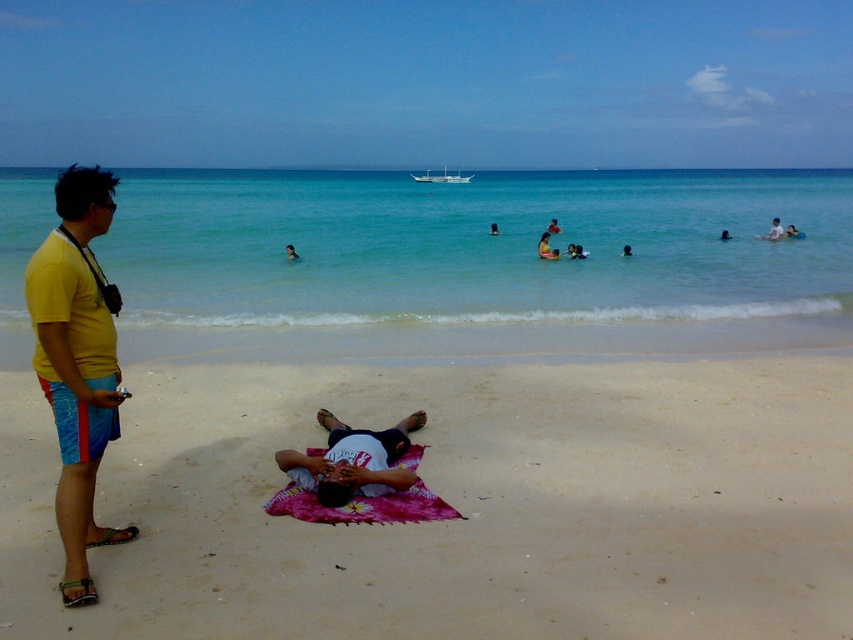
Question: Can you confirm if pink fabric at center is positioned below clear blue water at center?

Choices:
 (A) yes
 (B) no

Answer: (A)

Question: Among these points, which one is farthest from the camera?

Choices:
 (A) (80, 518)
 (B) (831, 486)
 (C) (751, 310)

Answer: (C)

Question: Is pink fabric at center below pink fabric blanket at center?

Choices:
 (A) yes
 (B) no

Answer: (A)

Question: Which of the following is the closest to the observer?

Choices:
 (A) pink fabric at center
 (B) pink fabric blanket at center
 (C) white matte shirt at center

Answer: (A)

Question: Which point is closer to the camera?

Choices:
 (A) (462, 516)
 (B) (376, 435)

Answer: (A)

Question: Is pink fabric at center closer to the viewer compared to clear blue water at center?

Choices:
 (A) no
 (B) yes

Answer: (B)